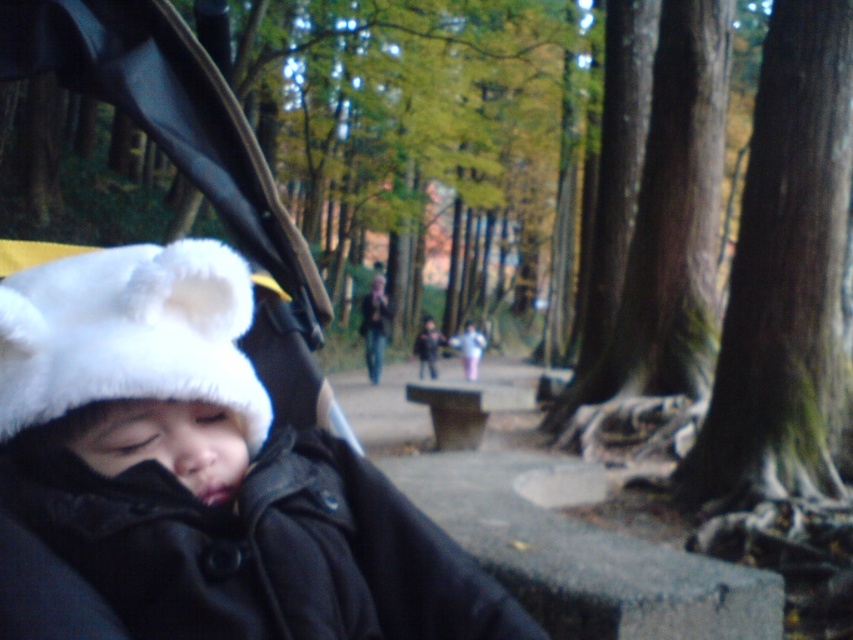
Between black matte jacket at left and white furry hat at left, which one has more height?

With more height is white furry hat at left.

Is point (148, 637) closer to camera compared to point (94, 355)?

Yes.

Does point (433, 637) lie behind point (96, 262)?

No.

Locate an element on the screen. This screenshot has width=853, height=640. black matte jacket at left is located at coordinates coord(259,548).

Where is `black fabric baby carriage at center`? The width and height of the screenshot is (853, 640). black fabric baby carriage at center is located at coordinates (206, 468).

Can you confirm if black fabric baby carriage at center is bigger than black matte jacket at left?

Correct, black fabric baby carriage at center is larger in size than black matte jacket at left.

This screenshot has width=853, height=640. Find the location of `black fabric baby carriage at center`. black fabric baby carriage at center is located at coordinates (206, 468).

Is point (281, 516) in front of point (44, 364)?

No, (281, 516) is further to viewer.

Between black fabric baby carriage at center and white furry hat at left, which one appears on the right side from the viewer's perspective?

Positioned to the right is black fabric baby carriage at center.

Does point (196, 400) lie behind point (32, 385)?

Yes, point (196, 400) is farther from viewer.

Find the location of a particular element. This screenshot has width=853, height=640. black fabric baby carriage at center is located at coordinates (206, 468).